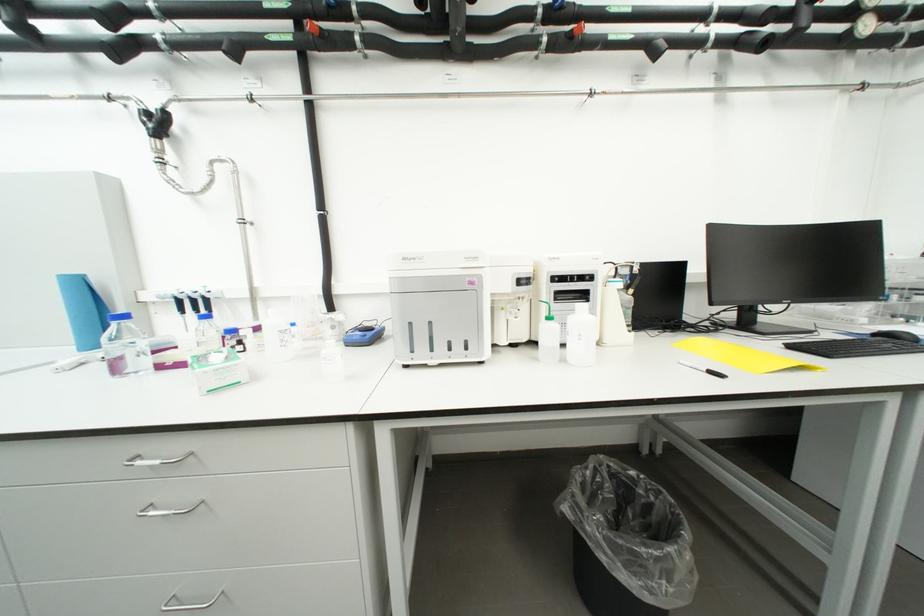
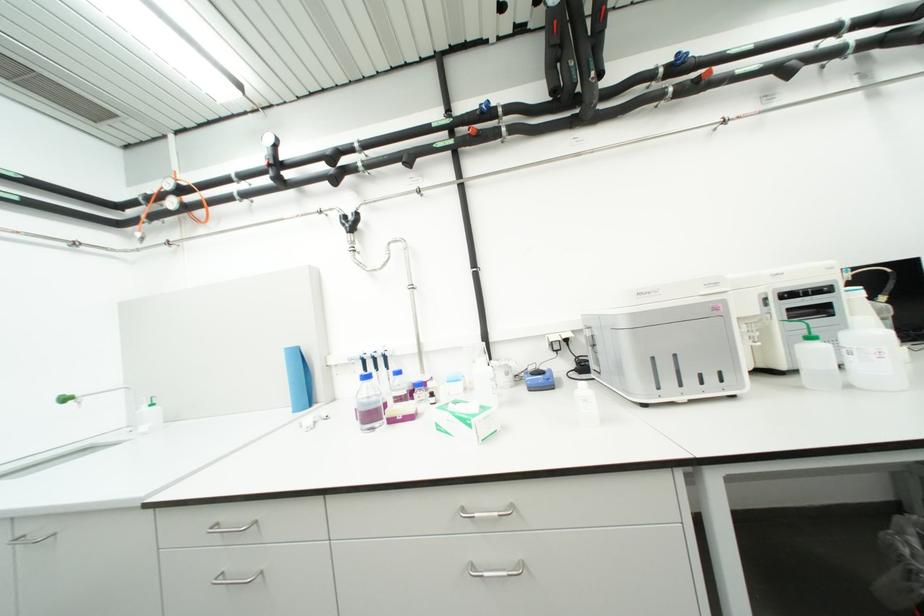
Question: In a continuous first-person perspective shot, in which direction is the camera moving?

Choices:
 (A) Left
 (B) Right
 (C) Forward
 (D) Backward

Answer: (A)